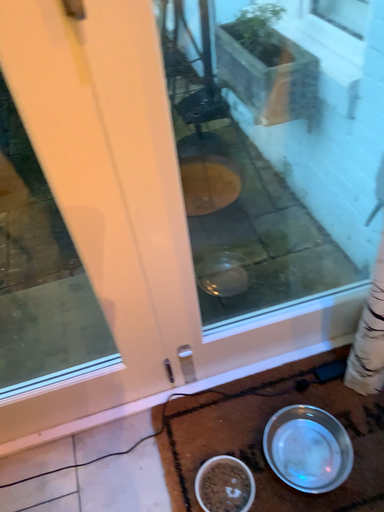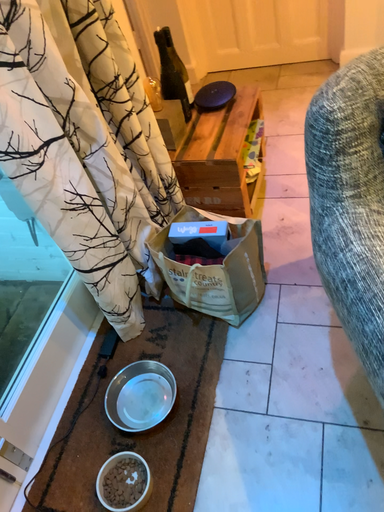
Question: Which way did the camera rotate in the video?

Choices:
 (A) rotated right
 (B) rotated left

Answer: (A)